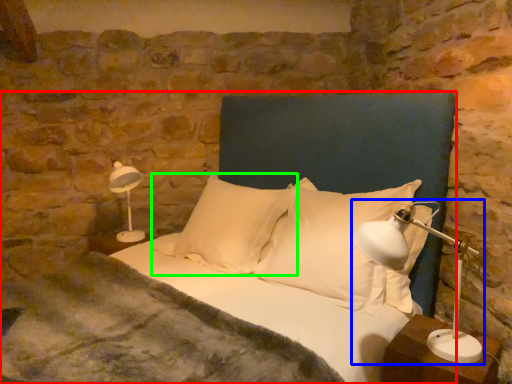
Question: Which is farther away from bed (highlighted by a red box)? table lamp (highlighted by a blue box) or pillow (highlighted by a green box)?

Choices:
 (A) table lamp
 (B) pillow

Answer: (A)